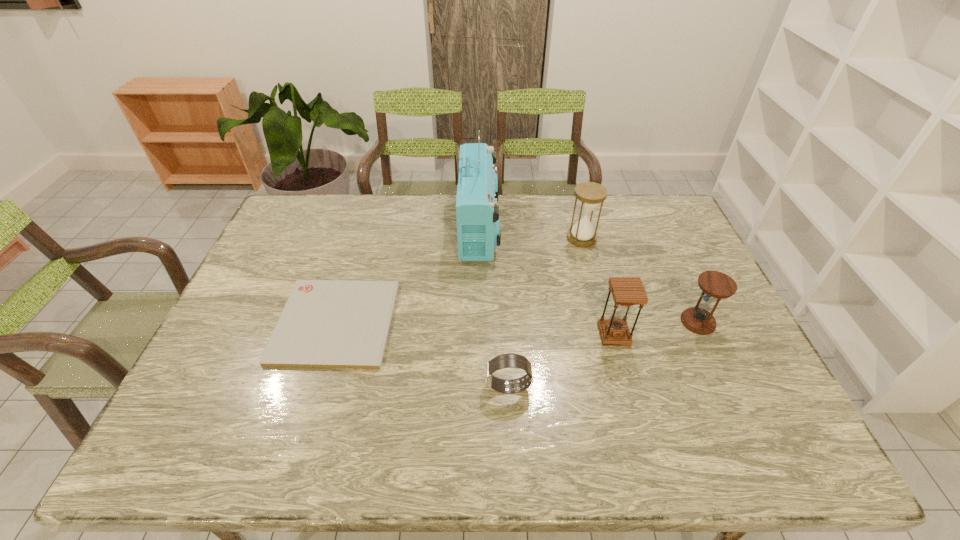
Where is `free location located on the left of the rightmost object`? This screenshot has width=960, height=540. free location located on the left of the rightmost object is located at coordinates (624, 322).

Find the location of `free spot located 0.210m on the face of the fifth tallest object`. free spot located 0.210m on the face of the fifth tallest object is located at coordinates pyautogui.click(x=400, y=387).

Identify the location of vacant space located 0.130m on the face of the fifth tallest object. pos(433,387).

This screenshot has height=540, width=960. I want to click on vacant point located 0.230m on the face of the fifth tallest object, so click(392, 387).

Identify the location of vacant space situated 0.080m on the left of the leftmost object. This screenshot has height=540, width=960. (251, 322).

Identify the location of radio receiver situated at the far edge. The height and width of the screenshot is (540, 960). (478, 219).

Locate an element on the screen. The width and height of the screenshot is (960, 540). hourglass that is at the far edge is located at coordinates (589, 194).

Locate an element on the screen. The height and width of the screenshot is (540, 960). object that is at the left edge is located at coordinates (325, 323).

Where is `object situated at the right edge`? The image size is (960, 540). object situated at the right edge is located at coordinates (715, 285).

The image size is (960, 540). What are the coordinates of `free space at the far edge` in the screenshot? It's located at (499, 198).